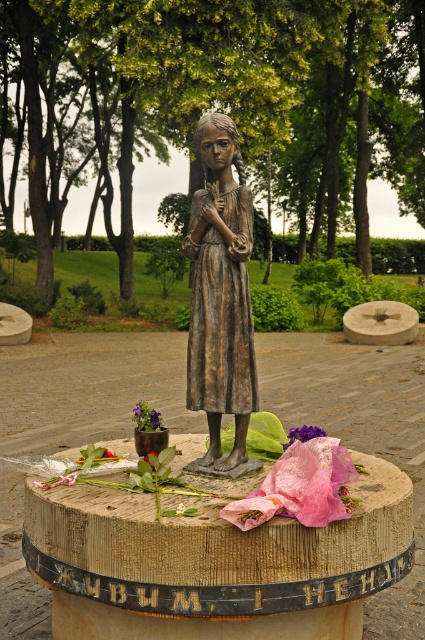
You are a gardener who wants to plant a new flower bed around the statue. The pink translucent petals at center and the green leafy at center are currently in the way. Which object should you move first to create space for the new flower bed, considering their height?

The pink translucent petals at center is much taller than the green leafy at center, so you should move the pink translucent petals at center first to create space for the new flower bed.